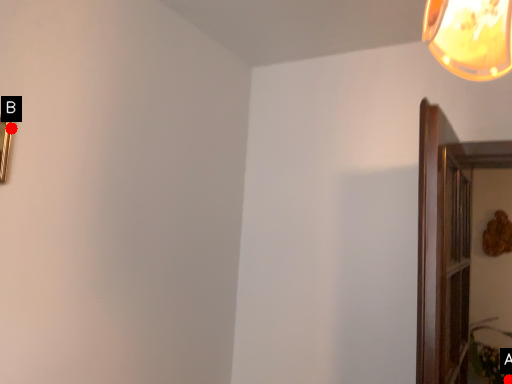
Question: Two points are circled on the image, labeled by A and B beside each circle. Which point is further to the camera?

Choices:
 (A) A is further
 (B) B is further

Answer: (A)